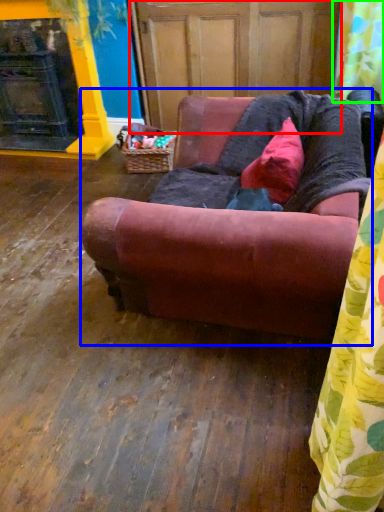
Question: Which object is the farthest from screen door (highlighted by a red box)? Choose among these: studio couch (highlighted by a blue box) or shower curtain (highlighted by a green box).

Choices:
 (A) studio couch
 (B) shower curtain

Answer: (A)